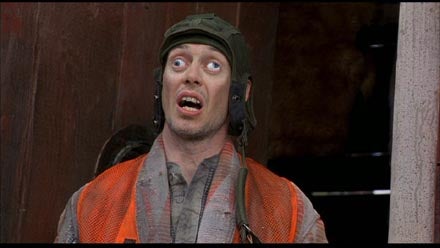
I want to click on dark wooden boards on wall, so click(92, 102).